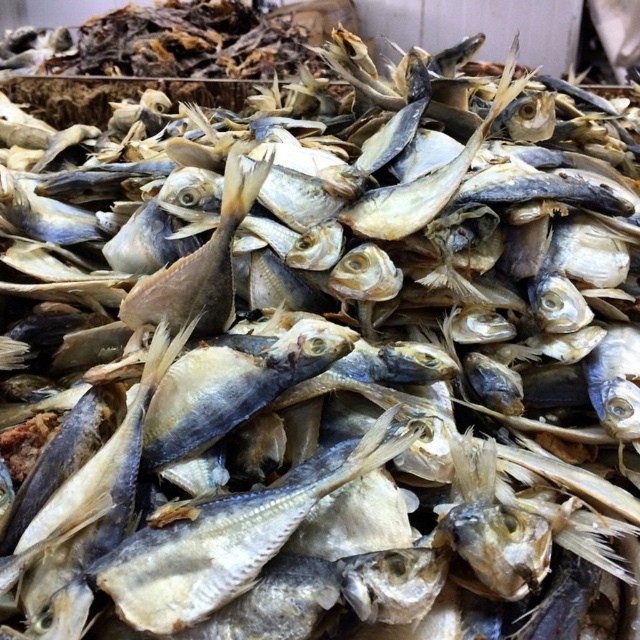
You are a fish seller who wants to display the shiny silver fish at center and the light brown dried fish at center in two different sections of your store. If you want to place the smaller fish in a section designed for smaller items, which fish should go there?

The shiny silver fish at center has a smaller size compared to the light brown dried fish at center, so it should be placed in the section for smaller items.

You are a vendor trying to display your dried fish attractively. You have a shiny silver fish at center and a light brown dried fish at center. Which fish should you choose to place in a spot that requires a wider display area?

You should choose the shiny silver fish at center because its width is larger than the light brown dried fish at center, making it better suited for a wider display area.

You are a customer looking at the pile of dried fish. You want to pick the shiny silver fish at center first, then the light brown dried fish at center. Which one should you move first to access the other?

The shiny silver fish at center is to the right of the light brown dried fish at center. To access the light brown dried fish at center first, you should move it before the shiny silver fish at center.